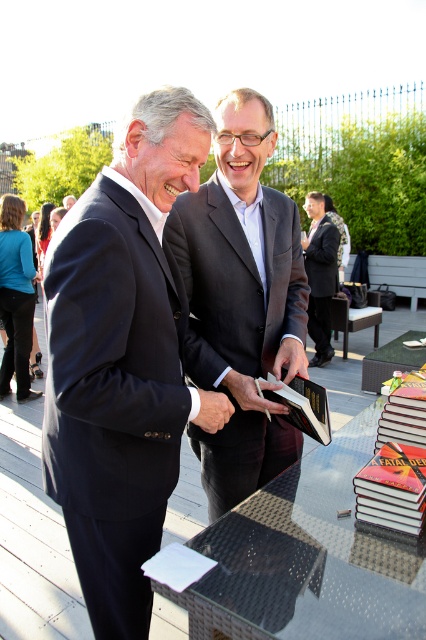
Based on the photo, you are a photographer at the event and need to capture a photo that includes both the navy blue suit at left and the matte black suit at center. Based on their positions, which one should you focus on first to ensure both are in frame?

The navy blue suit at left is positioned on the left side of matte black suit at center, so you should focus on the navy blue suit at left first to ensure both are in frame.

You are attending a book signing event and see two men in suits. The navy blue suit at left and the dark gray suit at center. Which one is more to the left?

The dark gray suit at center is more to the left because the navy blue suit at left is positioned on the right side of it.